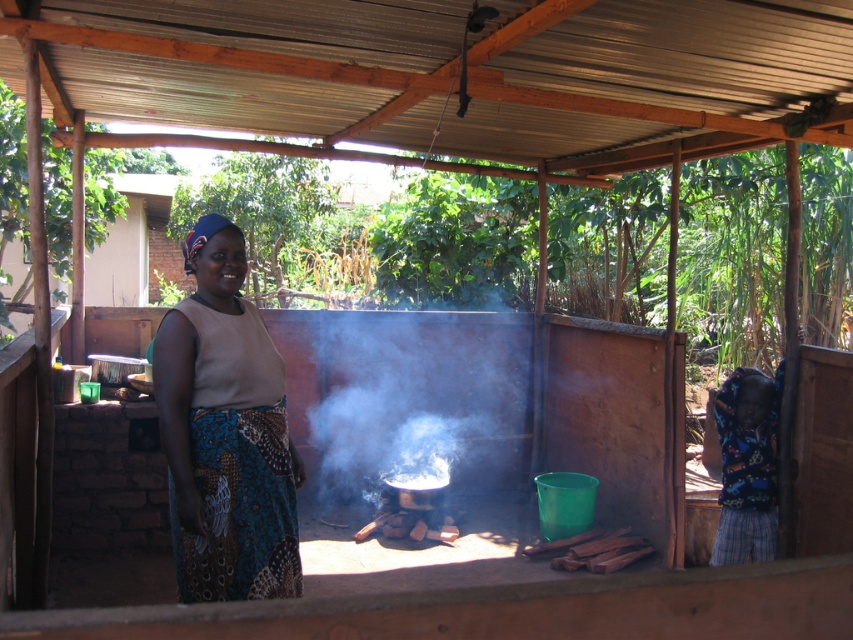
Question: Does printed fabric skirt at center have a larger size compared to white smoke at center?

Choices:
 (A) no
 (B) yes

Answer: (A)

Question: Which of the following is the farthest from the observer?

Choices:
 (A) printed fabric skirt at center
 (B) white smoke at center

Answer: (B)

Question: Which point is closer to the camera taking this photo?

Choices:
 (A) (173, 550)
 (B) (486, 461)

Answer: (A)

Question: In this image, where is printed fabric skirt at center located relative to white smoke at center?

Choices:
 (A) above
 (B) below

Answer: (A)

Question: Is printed fabric skirt at center smaller than white smoke at center?

Choices:
 (A) yes
 (B) no

Answer: (A)

Question: Which object appears farthest from the camera in this image?

Choices:
 (A) printed fabric skirt at center
 (B) white smoke at center

Answer: (B)